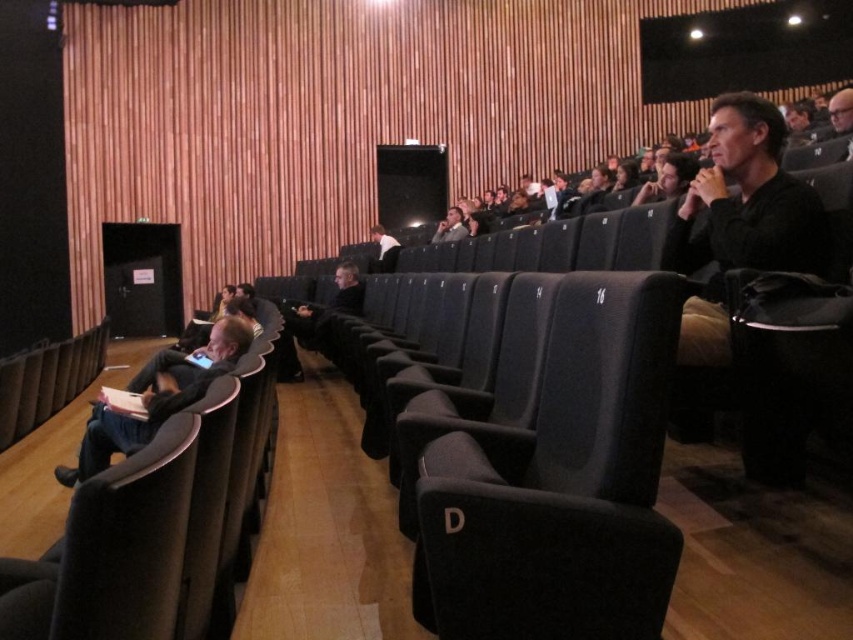
Describe the element at coordinates (561, 484) in the screenshot. I see `dark gray fabric seat at center` at that location.

Can you confirm if dark gray fabric seat at center is positioned to the right of black matte jacket at upper right?

No, dark gray fabric seat at center is not to the right of black matte jacket at upper right.

Does point (631, 577) come farther from viewer compared to point (717, 243)?

That is False.

Identify the location of dark gray fabric seat at center. (561, 484).

Who is taller, black matte jacket at upper right or dark gray fabric jacket at left?

black matte jacket at upper right

What do you see at coordinates (740, 220) in the screenshot? This screenshot has height=640, width=853. I see `black matte jacket at upper right` at bounding box center [740, 220].

Does point (805, 260) lie behind point (215, 340)?

No, (805, 260) is closer to viewer.

The width and height of the screenshot is (853, 640). In order to click on black matte jacket at upper right in this screenshot , I will do `click(740, 220)`.

Between dark gray fabric seat at center and dark gray fabric jacket at left, which one has less height?

Standing shorter between the two is dark gray fabric seat at center.

Is point (496, 595) positioned in front of point (108, 429)?

Yes.

Describe the element at coordinates (561, 484) in the screenshot. I see `dark gray fabric seat at center` at that location.

Image resolution: width=853 pixels, height=640 pixels. Find the location of `dark gray fabric seat at center`. dark gray fabric seat at center is located at coordinates (561, 484).